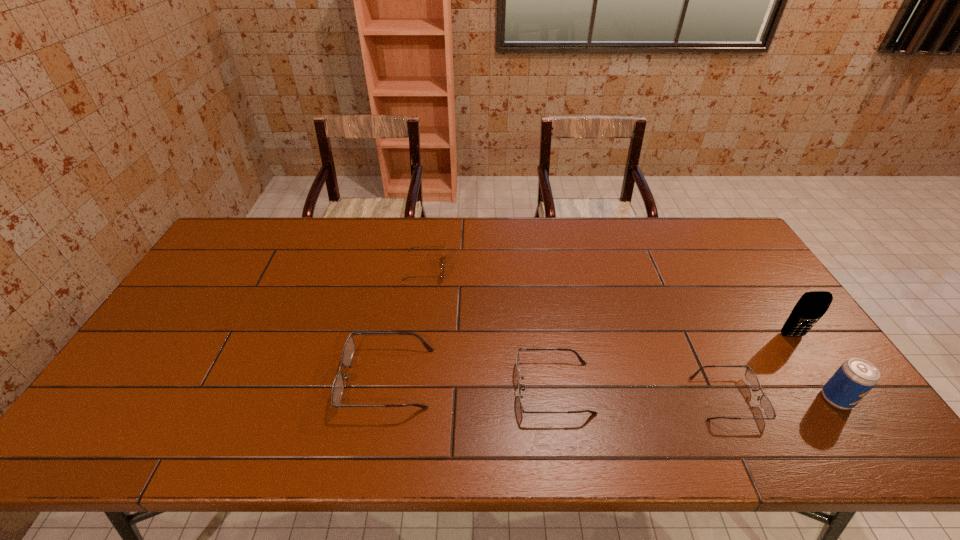
Locate an element on the screen. Image resolution: width=960 pixels, height=540 pixels. vacant space situated 0.340m on the front-facing side of the fourth tallest object is located at coordinates (209, 379).

I want to click on vacant space situated on the front-facing side of the fourth tallest object, so click(x=190, y=379).

The width and height of the screenshot is (960, 540). I want to click on free space located 0.340m on the front-facing side of the fourth tallest object, so click(x=209, y=379).

Identify the location of vacant space positioned 0.340m on the front-facing side of the third object from left to right. (380, 388).

This screenshot has height=540, width=960. Find the location of `vacant space positioned 0.180m on the front-facing side of the third object from left to right`. vacant space positioned 0.180m on the front-facing side of the third object from left to right is located at coordinates (444, 388).

Identify the location of vacant space situated 0.070m on the front-facing side of the third object from left to right. This screenshot has width=960, height=540. (489, 388).

Locate an element on the screen. The width and height of the screenshot is (960, 540). vacant area located on the front-facing side of the fourth object from left to right is located at coordinates (804, 399).

Locate an element on the screen. free point located 0.370m on the lenses of the sunglasses is located at coordinates (560, 269).

Locate an element on the screen. This screenshot has height=540, width=960. vacant space situated on the screen of the tallest object is located at coordinates (836, 400).

Image resolution: width=960 pixels, height=540 pixels. Find the location of `vacant space situated on the left of the beer can`. vacant space situated on the left of the beer can is located at coordinates (667, 399).